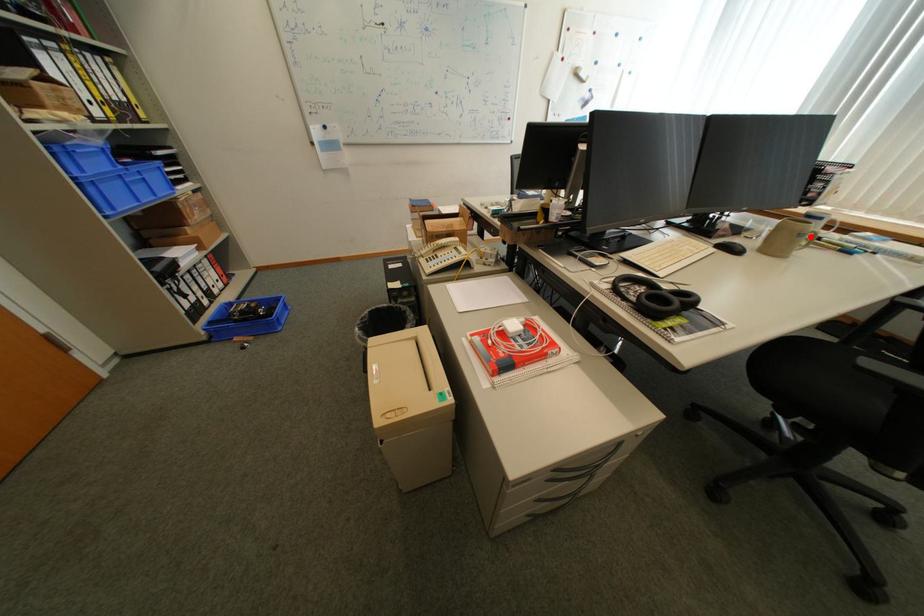
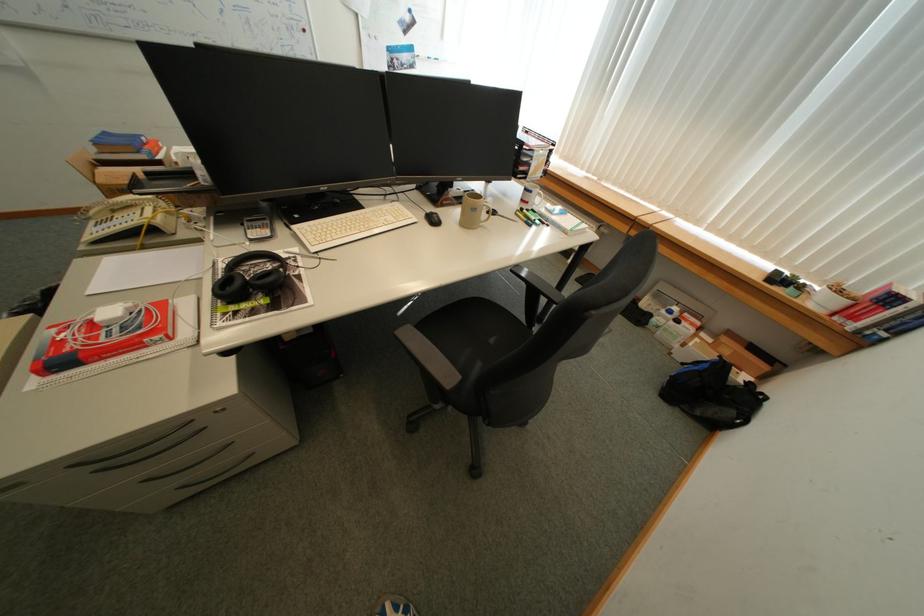
In the second image, find the point that corresponds to the highlighted location in the first image.

(483, 209)